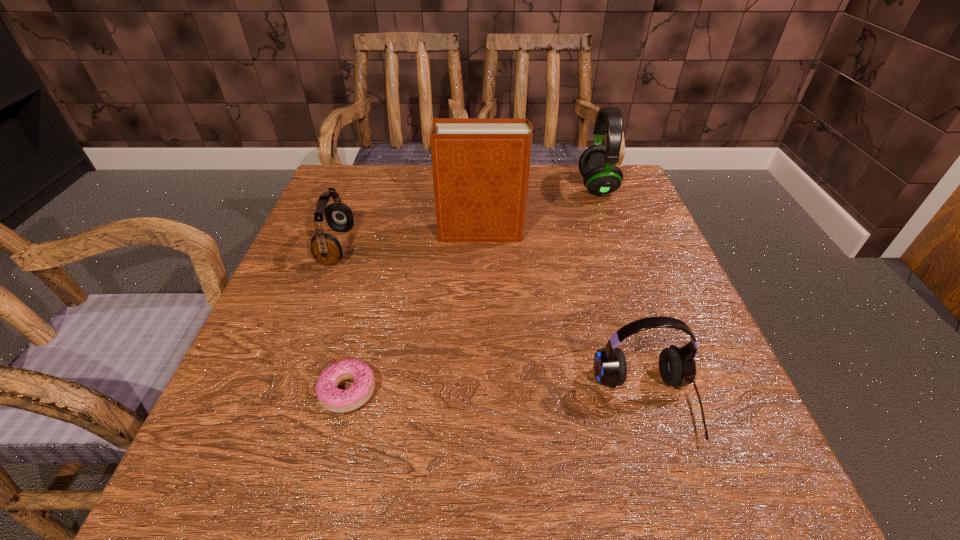
You are a GUI agent. You are given a task and a screenshot of the screen. Output one action in this format:
    pyautogui.click(x=<x>, y=<y>)
    Task: Click on the free space between the nearest headset and the leftmost object
    The image size is (960, 540).
    Given the screenshot: What is the action you would take?
    pyautogui.click(x=492, y=324)

This screenshot has height=540, width=960. Identify the location of the second closest object relative to the shortest object. (481, 166).

In order to click on the closest object to the farthest headset in this screenshot , I will do click(x=481, y=166).

Identify which headset is located as the nearest to the third object from left to right. Please provide its 2D coordinates. Your answer should be formatted as a tuple, i.e. [(x, y)], where the tuple contains the x and y coordinates of a point satisfying the conditions above.

[(597, 164)]

Locate which headset ranks second in proximity to the second object from left to right. Please provide its 2D coordinates. Your answer should be formatted as a tuple, i.e. [(x, y)], where the tuple contains the x and y coordinates of a point satisfying the conditions above.

[(677, 367)]

Identify the location of vacant space that satisfies the following two spatial constraints: 1. on the ear cups of the tallest headset; 2. on the front side of the shortest object. (671, 392).